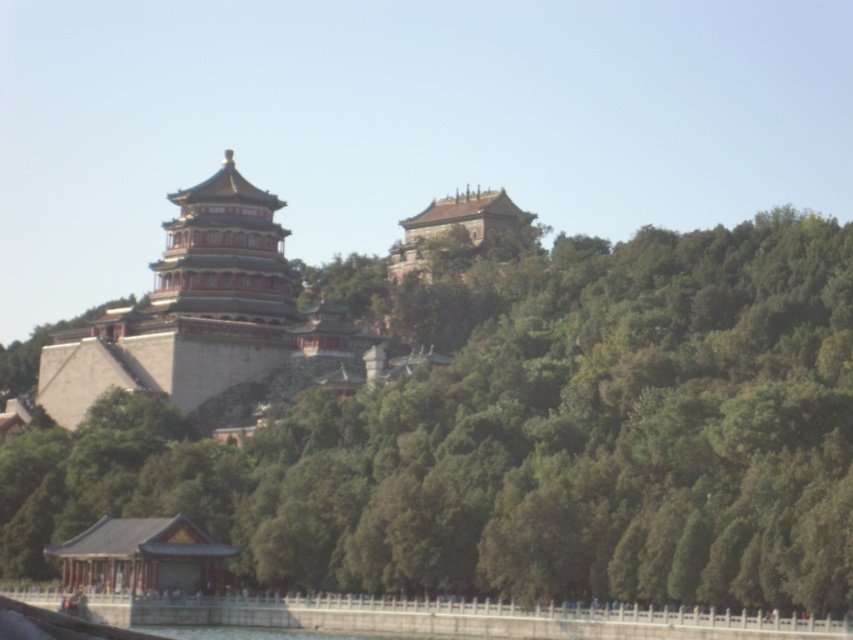
You are an architect designing a new garden layout and need to place a statue between the green leafy trees at center and the green stone pagoda at center. Based on their sizes, which side of the statue should face the larger object to ensure proper balance?

→ The green leafy trees at center are wider than the green stone pagoda at center. To balance the layout, the statue should face towards the green leafy trees at center since they are larger and will draw more visual weight.

Based on the scene description, which object is larger in size between the green leafy trees at center and the green stone pagoda at center?

The green leafy trees at center are larger in size than the green stone pagoda at center according to the description.

You are an architect visiting the scenic area and want to know which structure is taller between the green leafy trees at center and the green stone pagoda at center. Can you determine this based on the view?

The green leafy trees at center are taller than the green stone pagoda at center.